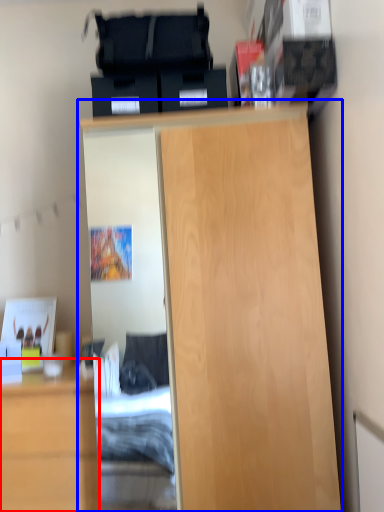
Question: Which object appears closest to the camera in this image, cabinetry (highlighted by a red box) or cupboard (highlighted by a blue box)?

Choices:
 (A) cabinetry
 (B) cupboard

Answer: (B)